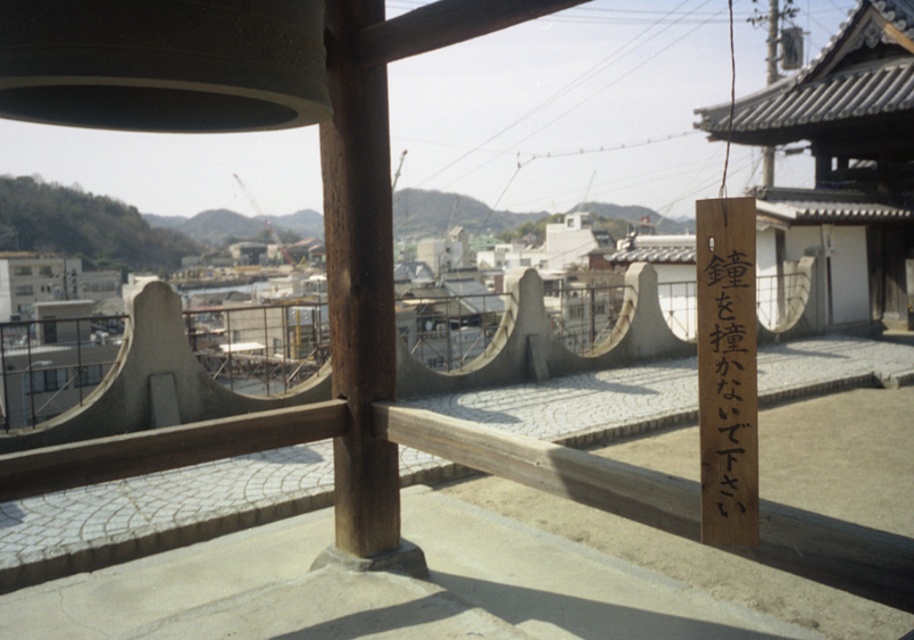
Question: Which of the following is the closest to the observer?

Choices:
 (A) (319, 129)
 (B) (737, 317)

Answer: (B)

Question: Is smooth brown wooden post at center thinner than black wood sign at center right?

Choices:
 (A) yes
 (B) no

Answer: (B)

Question: Can you confirm if smooth brown wooden post at center is positioned above black wood sign at center right?

Choices:
 (A) yes
 (B) no

Answer: (A)

Question: Does smooth brown wooden post at center have a greater width compared to black wood sign at center right?

Choices:
 (A) yes
 (B) no

Answer: (A)

Question: Which point is closer to the camera taking this photo?

Choices:
 (A) (715, 451)
 (B) (370, 474)

Answer: (A)